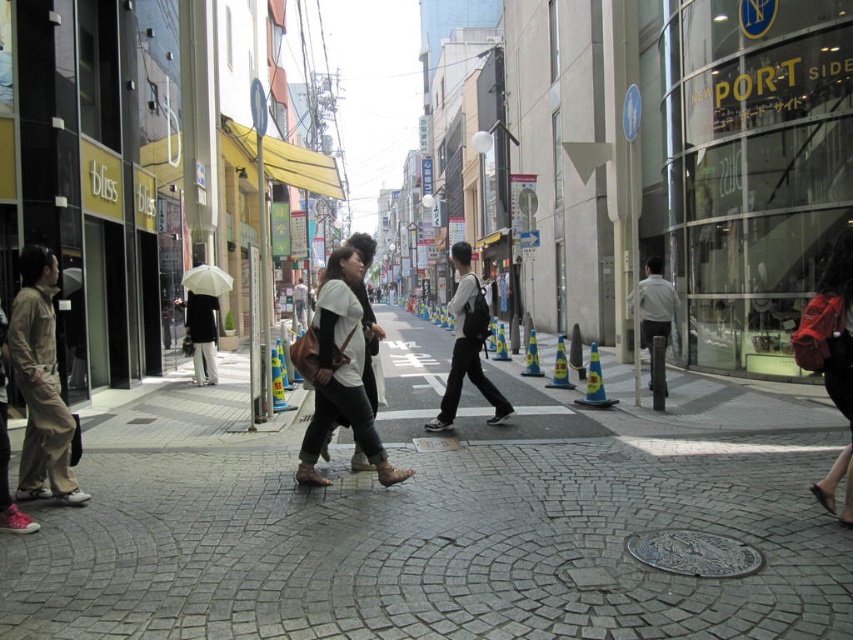
Question: Which of these objects is positioned farthest from the matte white shirt at center?

Choices:
 (A) matte pink backpack at lower right
 (B) gray cobblestone pavement at center
 (C) light gray shirt at center

Answer: (A)

Question: Which object is closer to the camera taking this photo?

Choices:
 (A) gray cobblestone pavement at center
 (B) matte white shirt at center

Answer: (A)

Question: From the image, what is the correct spatial relationship of khaki cotton pants at left in relation to matte white shirt at center?

Choices:
 (A) right
 (B) left

Answer: (A)

Question: Is the position of matte black backpack at center less distant than that of white matte umbrella at center?

Choices:
 (A) yes
 (B) no

Answer: (A)

Question: Which object is farther from the camera taking this photo?

Choices:
 (A) matte black backpack at center
 (B) matte brown bag at center
 (C) light gray shirt at center

Answer: (C)

Question: Can you confirm if gray cobblestone pavement at center is smaller than matte white shirt at center?

Choices:
 (A) yes
 (B) no

Answer: (A)